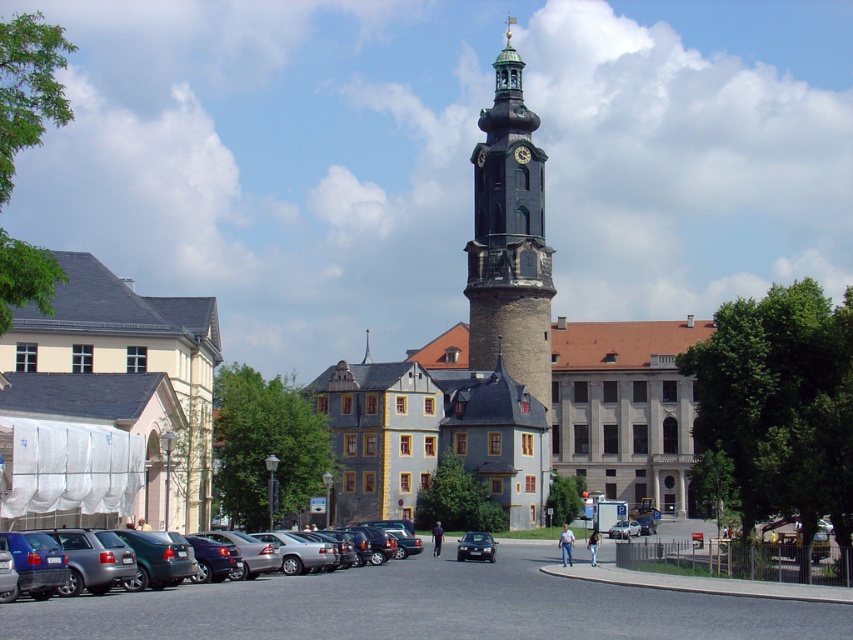
Question: Which object is the closest to the dark gray stone clock tower at center?

Choices:
 (A) beige fabric draped church at left
 (B) silver metallic sedan at center
 (C) shiny black sedan at center

Answer: (B)

Question: Which object is closer to the camera taking this photo?

Choices:
 (A) silver metallic sedan at center
 (B) gray metallic cars at lower left
 (C) metallic gray sedan at center-left

Answer: (B)

Question: In this image, where is beige fabric draped church at left located relative to shiny black sedan at center?

Choices:
 (A) below
 (B) above

Answer: (B)

Question: Is beige fabric draped church at left below shiny black sedan at center?

Choices:
 (A) no
 (B) yes

Answer: (A)

Question: Can you confirm if metallic gray sedan at center-left is bigger than silver metallic sedan at center?

Choices:
 (A) yes
 (B) no

Answer: (A)

Question: Which point is closer to the camera taking this photo?

Choices:
 (A) (618, 532)
 (B) (108, 307)
 (C) (520, 259)
 (D) (74, 609)

Answer: (D)